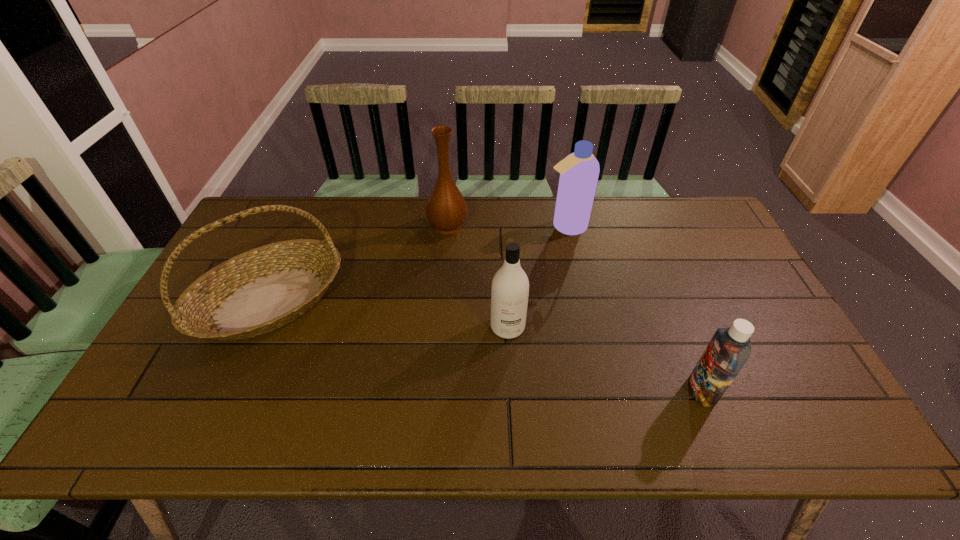
Locate an element on the screen. Image resolution: width=960 pixels, height=540 pixels. vacant region at the near edge of the desktop is located at coordinates (206, 423).

The image size is (960, 540). What are the coordinates of `vacant space at the left edge of the desktop` in the screenshot? It's located at (173, 337).

I want to click on free region at the right edge of the desktop, so click(797, 398).

This screenshot has height=540, width=960. In order to click on free space between the nearest object and the basket in this screenshot , I will do `click(486, 346)`.

Identify the location of free space between the nearest shampoo and the third object from right to left. (605, 359).

Locate an element on the screen. This screenshot has height=540, width=960. vacant space in between the leftmost shampoo and the second object from left to right is located at coordinates click(478, 276).

Identify the location of free space that is in between the basket and the nearest object. (486, 346).

Locate an element on the screen. The height and width of the screenshot is (540, 960). free space between the second shampoo from right to left and the rightmost shampoo is located at coordinates (634, 309).

Where is `vacant space in between the second shampoo from left to right and the rightmost object`? The height and width of the screenshot is (540, 960). vacant space in between the second shampoo from left to right and the rightmost object is located at coordinates (634, 309).

Locate an element on the screen. empty space between the second nearest shampoo and the nearest object is located at coordinates (605, 359).